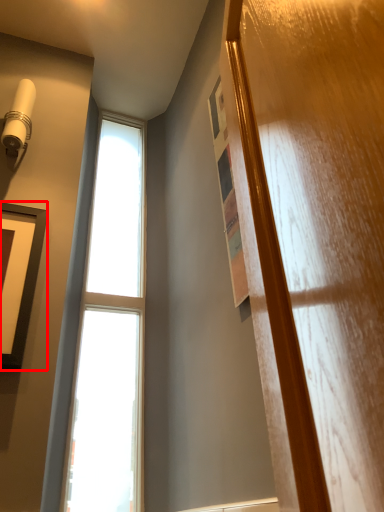
Question: From the image's perspective, considering the relative positions of picture frame (annotated by the red box) and window in the image provided, where is picture frame (annotated by the red box) located with respect to the staircase?

Choices:
 (A) above
 (B) below

Answer: (B)